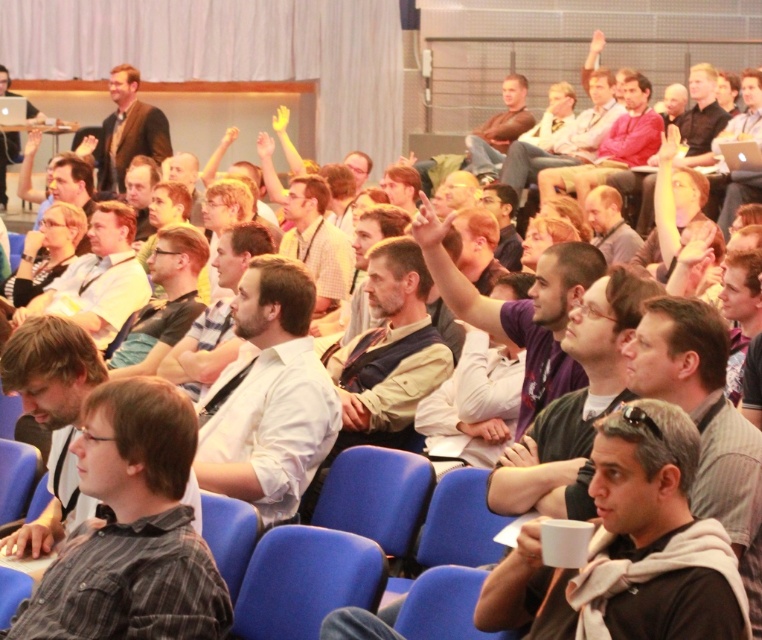
From the picture: You are sitting in the back row of the audience and want to ask a question. You notice two people in the front row wearing a gray striped shirt at center and a white shirt at center. Which one is sitting to the left of the other?

The gray striped shirt at center is positioned on the left side of white shirt at center, so the gray striped shirt at center is sitting to the left of the white shirt at center.

You are an event planner trying to determine the seating arrangement for a photo shoot. You notice two items at the center of the audience area. Which item is smaller in size between the gray striped shirt at center and the matte black glasses at center?

The gray striped shirt at center is smaller than the matte black glasses at center.

You are a photographer standing at the back of the room. You want to take a photo of the gray striped shirt at center and the matte black glasses at center. Which object should you focus on first if you want to capture both in the same frame without moving the camera?

The gray striped shirt at center is not as tall as matte black glasses at center, so you should focus on the matte black glasses at center first since it is taller and might be easier to capture clearly in the frame.